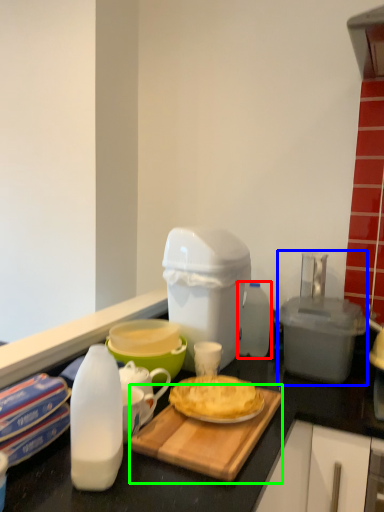
Question: Which object is positioned farthest from bottle (highlighted by a red box)? Select from appliance (highlighted by a blue box) and cutting board (highlighted by a green box).

Choices:
 (A) appliance
 (B) cutting board

Answer: (B)